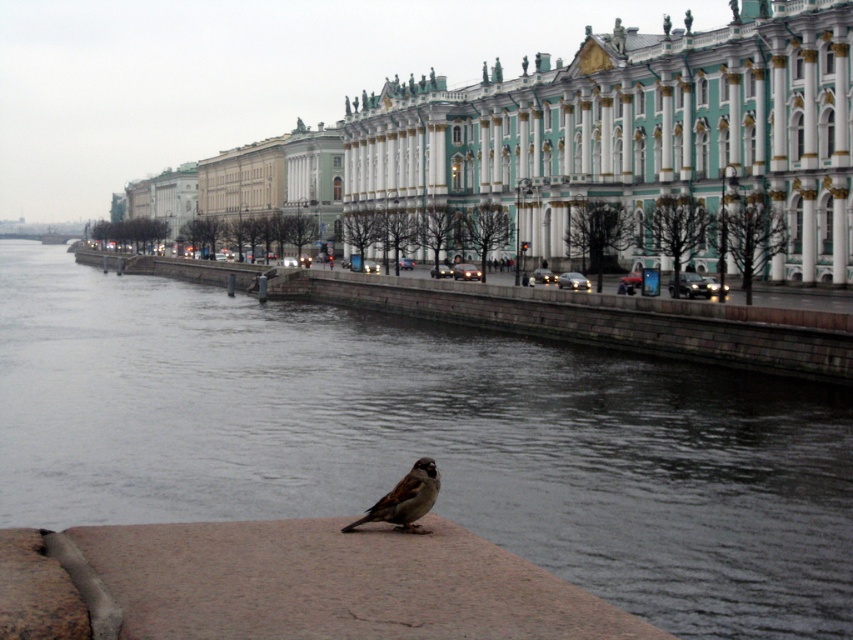
Question: Among these points, which one is farthest from the camera?

Choices:
 (A) (666, 22)
 (B) (401, 506)
 (C) (527, 547)

Answer: (A)

Question: Which of the following is the farthest from the observer?

Choices:
 (A) green marble palace at center
 (B) brown feathered sparrow at lower center

Answer: (A)

Question: Observing the image, what is the correct spatial positioning of gray concrete river at center in reference to brown feathered sparrow at lower center?

Choices:
 (A) left
 (B) right

Answer: (A)

Question: Is gray concrete river at center below brown feathered sparrow at lower center?

Choices:
 (A) yes
 (B) no

Answer: (B)

Question: Is gray concrete river at center above green marble palace at center?

Choices:
 (A) yes
 (B) no

Answer: (B)

Question: Among these points, which one is farthest from the camera?

Choices:
 (A) (427, 490)
 (B) (248, 480)

Answer: (B)